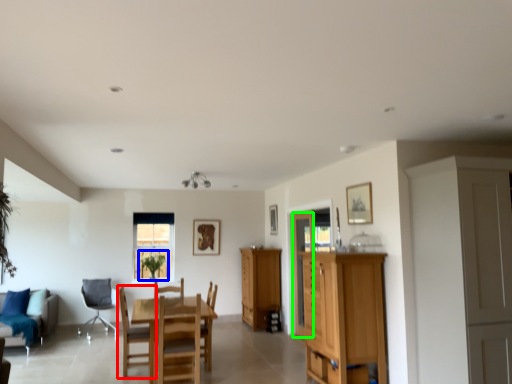
Question: Estimate the real-world distances between objects in this image. Which object is farther from chair (highlighted by a red box), plant (highlighted by a blue box) or glass door (highlighted by a green box)?

Choices:
 (A) plant
 (B) glass door

Answer: (B)